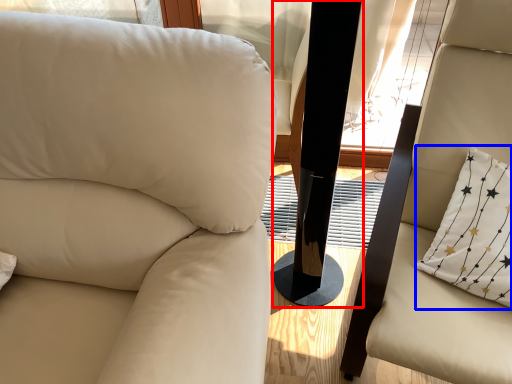
Question: Which object appears closest to the camera in this image, pillar (highlighted by a red box) or pillow (highlighted by a blue box)?

Choices:
 (A) pillar
 (B) pillow

Answer: (A)